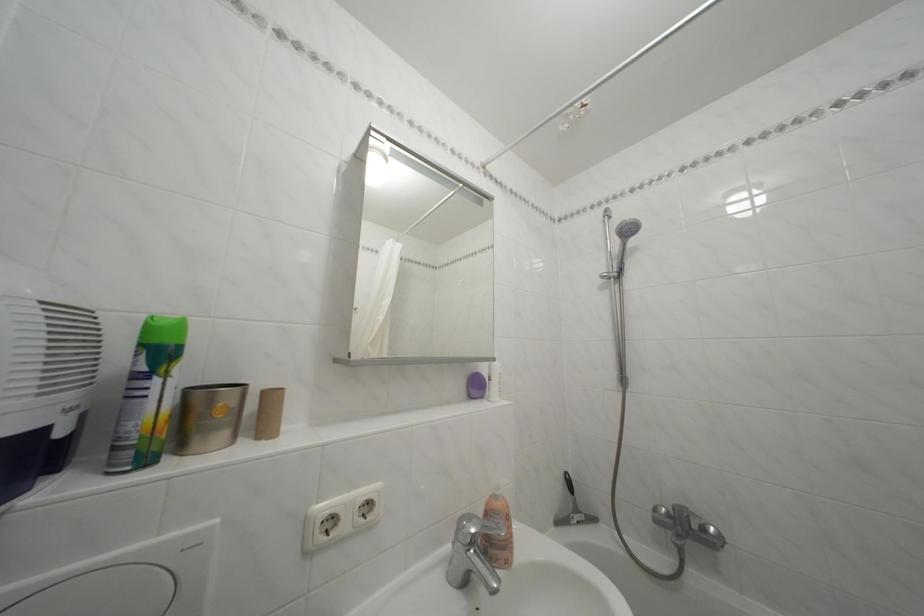
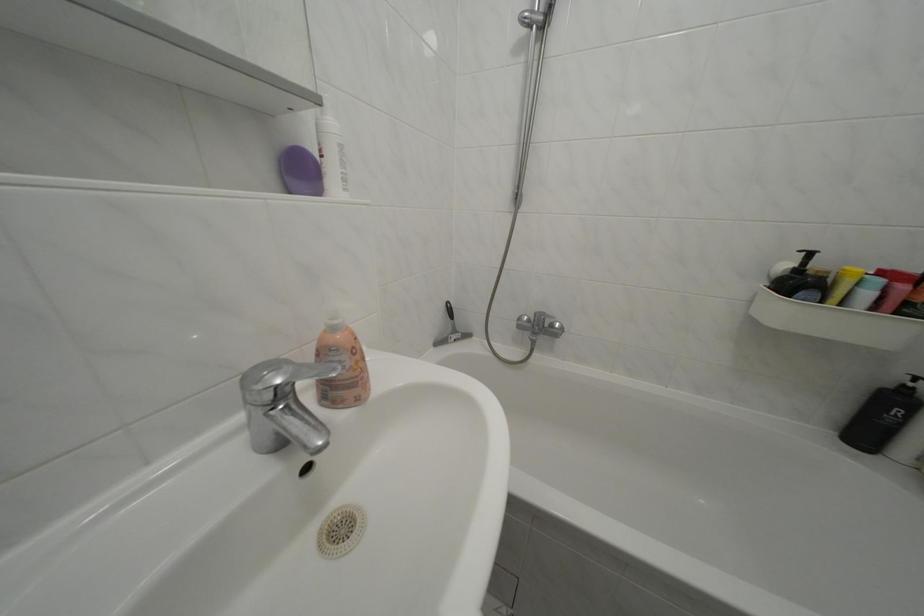
Find the pixel in the second image that matches point 505,504 in the first image.

(342, 334)